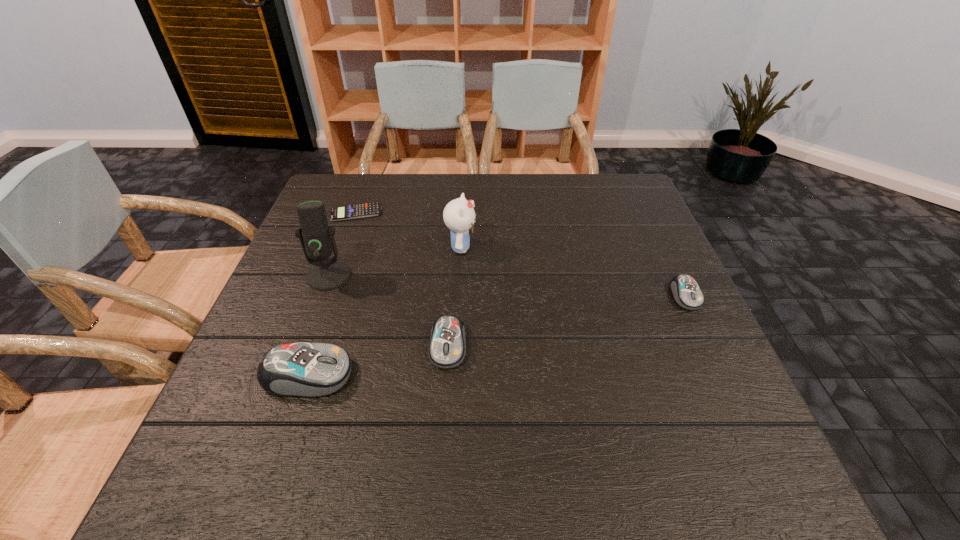
The image size is (960, 540). Find the location of `calculator that is at the left edge`. calculator that is at the left edge is located at coordinates (354, 211).

Image resolution: width=960 pixels, height=540 pixels. Find the location of `microphone positioned at the left edge`. microphone positioned at the left edge is located at coordinates (317, 239).

I want to click on object at the right edge, so pos(686,292).

Locate an element on the screen. The height and width of the screenshot is (540, 960). object at the far left corner is located at coordinates (354, 211).

I want to click on object at the near left corner, so click(x=299, y=369).

I want to click on free space at the far edge, so click(540, 189).

Identify the location of vacant space at the near edge. This screenshot has width=960, height=540. (453, 389).

In the image, there is a desktop. At what (x,y) coordinates should I click in order to perform the action: click on blank space at the left edge. Please return your answer as a coordinate pair (x, y). Looking at the image, I should click on (311, 329).

Locate an element on the screen. The width and height of the screenshot is (960, 540). vacant area at the right edge is located at coordinates (706, 376).

This screenshot has width=960, height=540. Identify the location of vacant space at the far right corner of the desktop. (600, 209).